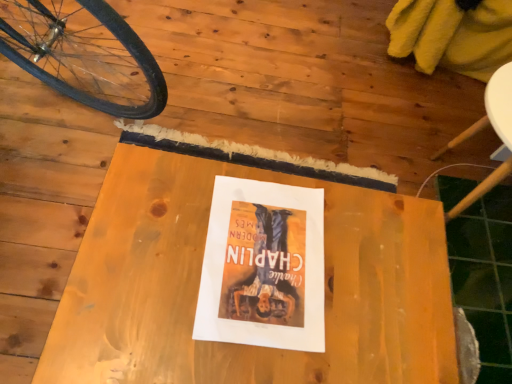
Where is `free location above wooden table at center (from a real-world perspective)`? The height and width of the screenshot is (384, 512). free location above wooden table at center (from a real-world perspective) is located at coordinates (251, 277).